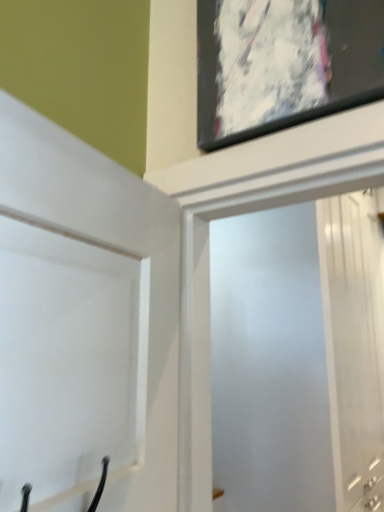
Question: Considering the relative sizes of white matte door at upper left and frosted glass screen door at upper center in the image provided, is white matte door at upper left thinner than frosted glass screen door at upper center?

Choices:
 (A) yes
 (B) no

Answer: (A)

Question: From the image's perspective, would you say white matte door at upper left is positioned over frosted glass screen door at upper center?

Choices:
 (A) yes
 (B) no

Answer: (A)

Question: Does white matte door at upper left have a lesser height compared to frosted glass screen door at upper center?

Choices:
 (A) no
 (B) yes

Answer: (B)

Question: Is white matte door at upper left not inside frosted glass screen door at upper center?

Choices:
 (A) yes
 (B) no

Answer: (A)

Question: Considering the relative positions of white matte door at upper left and frosted glass screen door at upper center in the image provided, is white matte door at upper left to the right of frosted glass screen door at upper center from the viewer's perspective?

Choices:
 (A) no
 (B) yes

Answer: (A)

Question: Is white matte door at upper left taller than frosted glass screen door at upper center?

Choices:
 (A) yes
 (B) no

Answer: (B)

Question: Can you confirm if frosted glass screen door at upper center is shorter than white matte door at upper left?

Choices:
 (A) no
 (B) yes

Answer: (A)

Question: Is frosted glass screen door at upper center at the left side of white matte door at upper left?

Choices:
 (A) no
 (B) yes

Answer: (A)

Question: Is frosted glass screen door at upper center further to camera compared to white matte door at upper left?

Choices:
 (A) yes
 (B) no

Answer: (A)

Question: From the image's perspective, is frosted glass screen door at upper center under white matte door at upper left?

Choices:
 (A) yes
 (B) no

Answer: (A)

Question: Does frosted glass screen door at upper center have a larger size compared to white matte door at upper left?

Choices:
 (A) yes
 (B) no

Answer: (A)

Question: Is frosted glass screen door at upper center directly adjacent to white matte door at upper left?

Choices:
 (A) yes
 (B) no

Answer: (B)

Question: Considering the positions of white matte door at upper left and frosted glass screen door at upper center in the image, is white matte door at upper left taller or shorter than frosted glass screen door at upper center?

Choices:
 (A) tall
 (B) short

Answer: (B)